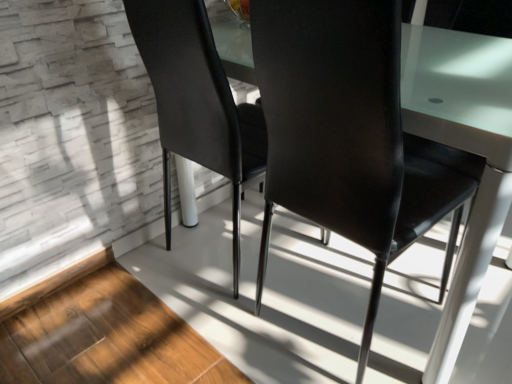
Where is `free space to the left of matte black chair at center, the 1th chair in the right-to-left sequence`? The width and height of the screenshot is (512, 384). free space to the left of matte black chair at center, the 1th chair in the right-to-left sequence is located at coordinates (184, 328).